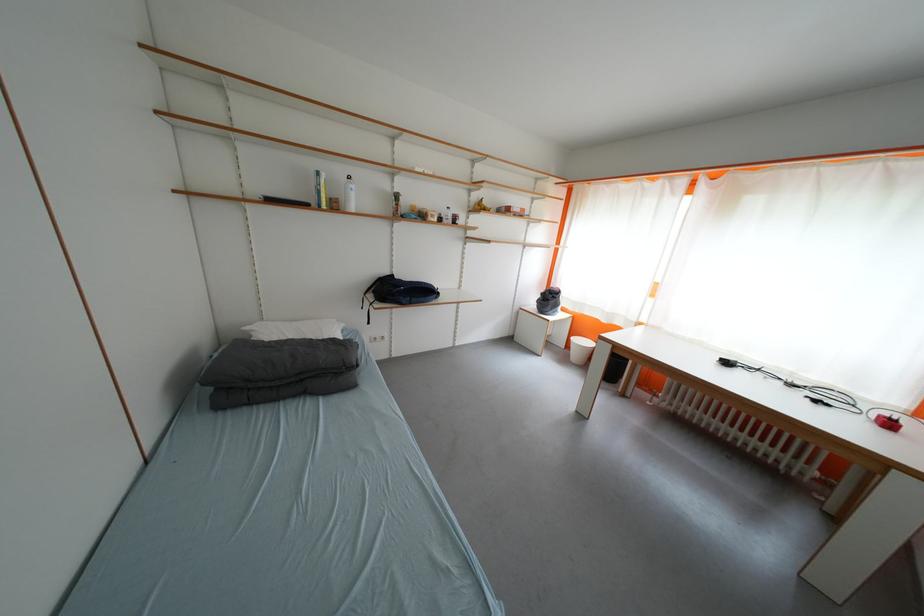
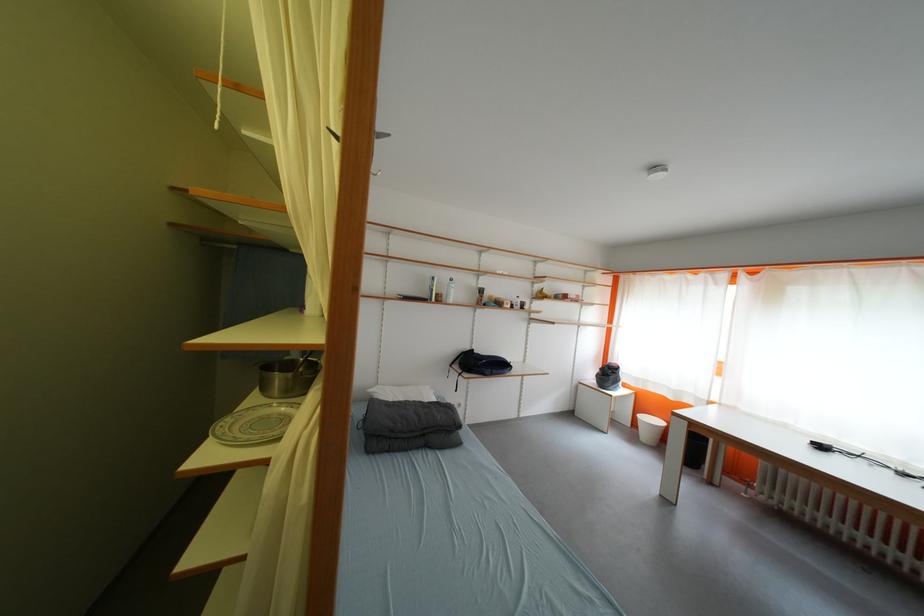
Locate, in the second image, the point that corresponds to [310,383] in the first image.

(432, 438)